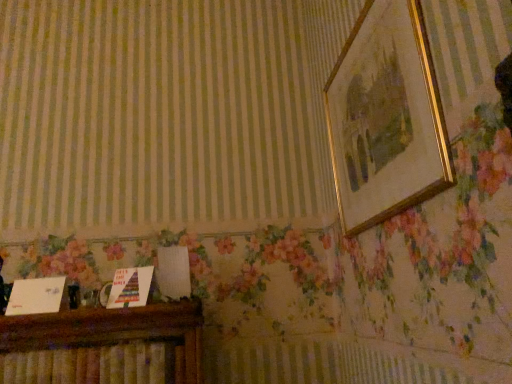
What do you see at coordinates (385, 118) in the screenshot? I see `gold/golden picture frame at upper right` at bounding box center [385, 118].

The image size is (512, 384). I want to click on gold/golden picture frame at upper right, so click(385, 118).

The width and height of the screenshot is (512, 384). What are the coordinates of `wooden cabinet at lower left` in the screenshot? It's located at (109, 336).

In order to face wooden cabinet at lower left, should I rotate leftwards or rightwards?

To face it directly, rotate left by 21.557 degrees.

The width and height of the screenshot is (512, 384). What do you see at coordinates (109, 336) in the screenshot?
I see `wooden cabinet at lower left` at bounding box center [109, 336].

I want to click on gold/golden picture frame at upper right, so click(x=385, y=118).

Which object is positioned more to the right, gold/golden picture frame at upper right or wooden cabinet at lower left?

gold/golden picture frame at upper right.

Which object is more forward, gold/golden picture frame at upper right or wooden cabinet at lower left?

gold/golden picture frame at upper right is in front.

Is point (375, 185) positioned after point (93, 382)?

No, (375, 185) is closer to viewer.

From the image's perspective, is gold/golden picture frame at upper right over wooden cabinet at lower left?

Yes, from the image's perspective, gold/golden picture frame at upper right is on top of wooden cabinet at lower left.

From a real-world perspective, is gold/golden picture frame at upper right positioned above or below wooden cabinet at lower left?

Clearly, from a real-world perspective, gold/golden picture frame at upper right is above wooden cabinet at lower left.

Considering the sizes of objects gold/golden picture frame at upper right and wooden cabinet at lower left in the image provided, who is wider, gold/golden picture frame at upper right or wooden cabinet at lower left?

With larger width is wooden cabinet at lower left.

Who is taller, gold/golden picture frame at upper right or wooden cabinet at lower left?

With more height is gold/golden picture frame at upper right.

Can you confirm if gold/golden picture frame at upper right is smaller than wooden cabinet at lower left?

Actually, gold/golden picture frame at upper right might be larger than wooden cabinet at lower left.

Would you say wooden cabinet at lower left is part of gold/golden picture frame at upper right's contents?

That's incorrect, wooden cabinet at lower left is not inside gold/golden picture frame at upper right.

Based on the photo, would you say gold/golden picture frame at upper right is a long distance from wooden cabinet at lower left?

That's not correct — gold/golden picture frame at upper right is a little close to wooden cabinet at lower left.

Is gold/golden picture frame at upper right aimed at wooden cabinet at lower left?

No, gold/golden picture frame at upper right is not facing towards wooden cabinet at lower left.

How far apart are gold/golden picture frame at upper right and wooden cabinet at lower left?

34.67 inches.

Locate an element on the screen. The width and height of the screenshot is (512, 384). picture frame above the wooden cabinet at lower left (from a real-world perspective) is located at coordinates (385, 118).

Is wooden cabinet at lower left to the left of gold/golden picture frame at upper right from the viewer's perspective?

Yes, wooden cabinet at lower left is to the left of gold/golden picture frame at upper right.

Is wooden cabinet at lower left in front of or behind gold/golden picture frame at upper right in the image?

wooden cabinet at lower left is behind gold/golden picture frame at upper right.

Does point (166, 330) appear closer or farther from the camera than point (419, 178)?

Point (166, 330) is positioned farther from the camera compared to point (419, 178).

From the image's perspective, is wooden cabinet at lower left positioned above or below gold/golden picture frame at upper right?

wooden cabinet at lower left is below gold/golden picture frame at upper right.

From a real-world perspective, which is physically below, wooden cabinet at lower left or gold/golden picture frame at upper right?

In real-world perspective, wooden cabinet at lower left is lower.

Considering the relative sizes of wooden cabinet at lower left and gold/golden picture frame at upper right in the image provided, is wooden cabinet at lower left thinner than gold/golden picture frame at upper right?

No, wooden cabinet at lower left is not thinner than gold/golden picture frame at upper right.

Between wooden cabinet at lower left and gold/golden picture frame at upper right, which one has more height?

gold/golden picture frame at upper right.

Looking at the image, does wooden cabinet at lower left seem bigger or smaller compared to gold/golden picture frame at upper right?

Considering their sizes, wooden cabinet at lower left takes up less space than gold/golden picture frame at upper right.

Is wooden cabinet at lower left outside of gold/golden picture frame at upper right?

wooden cabinet at lower left is positioned outside gold/golden picture frame at upper right.

Based on the photo, are wooden cabinet at lower left and gold/golden picture frame at upper right far apart?

wooden cabinet at lower left is near gold/golden picture frame at upper right, not far away.

Is wooden cabinet at lower left facing away from gold/golden picture frame at upper right?

No, gold/golden picture frame at upper right is not at the back of wooden cabinet at lower left.

The image size is (512, 384). In order to click on furniture that is on the left side of gold/golden picture frame at upper right in this screenshot , I will do `click(109, 336)`.

Where is `picture frame above the wooden cabinet at lower left (from the image's perspective)`? This screenshot has width=512, height=384. picture frame above the wooden cabinet at lower left (from the image's perspective) is located at coordinates (385, 118).

Identify the location of furniture that is under the gold/golden picture frame at upper right (from a real-world perspective). This screenshot has height=384, width=512. (109, 336).